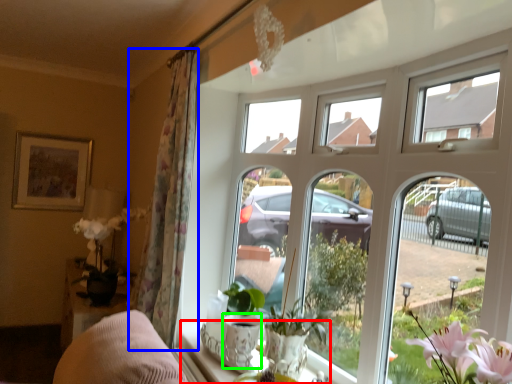
Question: Which object is the farthest from window sill (highlighted by a red box)? Choose among these: curtain (highlighted by a blue box) or glass vase (highlighted by a green box).

Choices:
 (A) curtain
 (B) glass vase

Answer: (A)